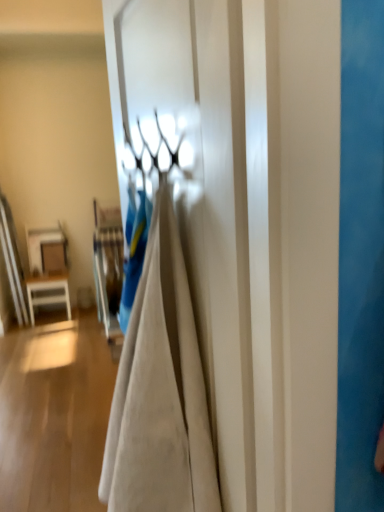
Question: From their relative heights in the image, would you say white matte door at center is taller or shorter than white glossy table at left?

Choices:
 (A) tall
 (B) short

Answer: (A)

Question: Is point (178, 202) closer or farther from the camera than point (26, 236)?

Choices:
 (A) farther
 (B) closer

Answer: (B)

Question: Relative to white glossy table at left, is white matte door at center in front or behind?

Choices:
 (A) front
 (B) behind

Answer: (A)

Question: Would you say white glossy table at left is to the left or to the right of white matte door at center in the picture?

Choices:
 (A) left
 (B) right

Answer: (A)

Question: From the image's perspective, is white glossy table at left positioned above or below white matte door at center?

Choices:
 (A) below
 (B) above

Answer: (A)

Question: Considering the positions of white glossy table at left and white matte door at center in the image, is white glossy table at left taller or shorter than white matte door at center?

Choices:
 (A) short
 (B) tall

Answer: (A)

Question: In the image, is white glossy table at left positioned in front of or behind white matte door at center?

Choices:
 (A) behind
 (B) front

Answer: (A)